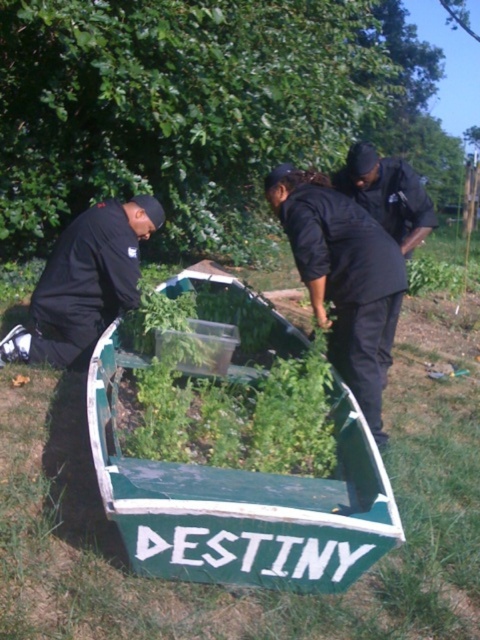
Question: Where is green leafy vegetable at center located in relation to black matte shirt at center in the image?

Choices:
 (A) right
 (B) left

Answer: (B)

Question: Which point is farther from the camera taking this photo?

Choices:
 (A) (113, 241)
 (B) (227, 548)
 (C) (403, 209)

Answer: (C)

Question: Which object is positioned farthest from the green painted wood boat at center?

Choices:
 (A) black matte jacket at left
 (B) black matte shirt at center

Answer: (A)

Question: Which of these objects is positioned closest to the black matte jacket at left?

Choices:
 (A) black matte shirt at center
 (B) green leafy vegetable at center
 (C) black matte uniform at upper right

Answer: (B)

Question: Can you confirm if green leafy vegetable at center is positioned below black matte uniform at upper right?

Choices:
 (A) no
 (B) yes

Answer: (B)

Question: Can you confirm if green painted wood boat at center is positioned below green leafy vegetable at center?

Choices:
 (A) yes
 (B) no

Answer: (A)